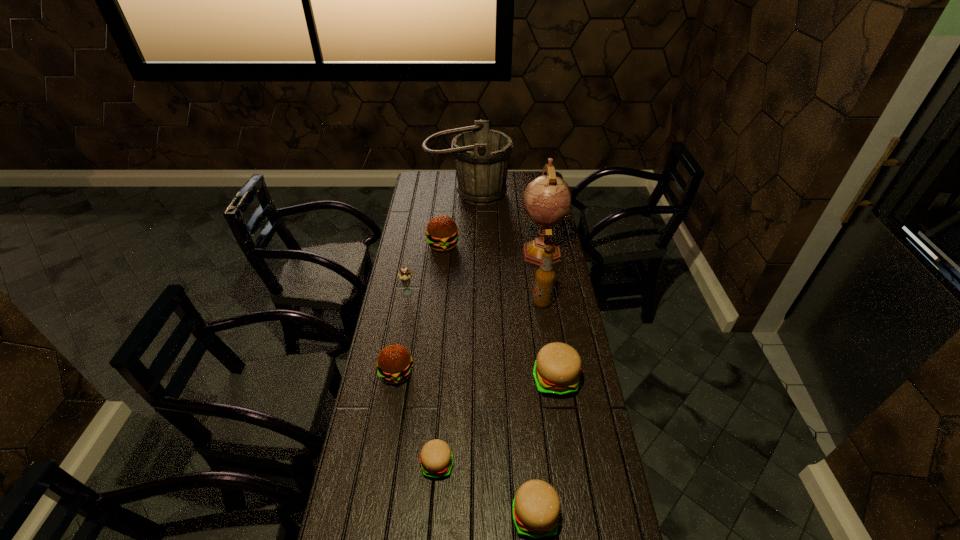
You are a GUI agent. You are given a task and a screenshot of the screen. Output one action in this format:
    pyautogui.click(x=<x>, y=<y>)
    Task: Click on the vacant space situated on the front of the smaller brown hamburger
    
    Given the screenshot: What is the action you would take?
    pyautogui.click(x=384, y=449)

The width and height of the screenshot is (960, 540). Identify the location of vacant space located 0.340m on the right of the shortest object. (565, 465).

Identify the location of object at the far edge. This screenshot has height=540, width=960. (481, 155).

This screenshot has width=960, height=540. I want to click on bucket at the left edge, so click(481, 155).

Locate an element on the screen. The height and width of the screenshot is (540, 960). icecream at the left edge is located at coordinates (404, 275).

Where is `globe that is at the right edge`? globe that is at the right edge is located at coordinates (546, 200).

Identify the location of beer bottle present at the right edge. (545, 276).

Locate an element on the screen. hamburger located at the right edge is located at coordinates (557, 368).

Find the location of a particular element. This screenshot has width=960, height=540. object present at the far left corner is located at coordinates (481, 155).

In the image, there is a desktop. Where is `vacant space at the left edge`? The width and height of the screenshot is (960, 540). vacant space at the left edge is located at coordinates (380, 338).